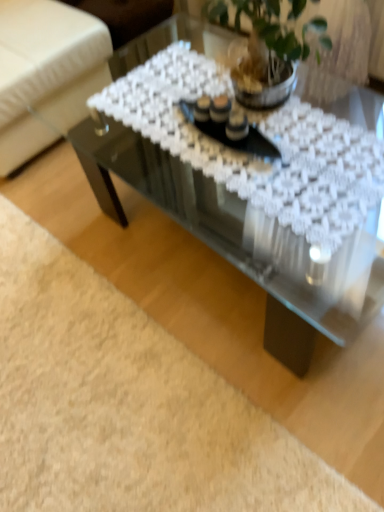
Find the location of a particular element. vacant region to the left of clear glass plate at center is located at coordinates (170, 130).